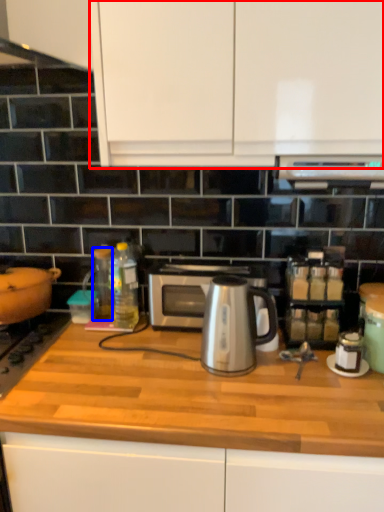
Question: Which object appears closest to the camera in this image, cabinetry (highlighted by a red box) or bottle (highlighted by a blue box)?

Choices:
 (A) cabinetry
 (B) bottle

Answer: (A)